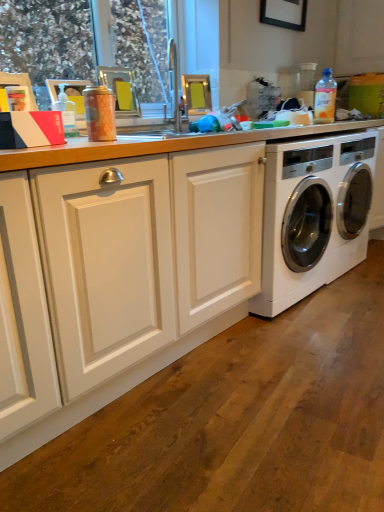
Question: Can you confirm if transparent plastic window screen at upper left is positioned to the right of transparent plastic bottle at upper left, the second bottle from the top?

Choices:
 (A) yes
 (B) no

Answer: (A)

Question: From a real-world perspective, is transparent plastic window screen at upper left located higher than transparent plastic bottle at upper left, the second bottle from the top?

Choices:
 (A) yes
 (B) no

Answer: (A)

Question: Are transparent plastic window screen at upper left and transparent plastic bottle at upper left, arranged as the first bottle when ordered from the bottom, making contact?

Choices:
 (A) yes
 (B) no

Answer: (B)

Question: Is transparent plastic window screen at upper left shorter than transparent plastic bottle at upper left, arranged as the first bottle when ordered from the bottom?

Choices:
 (A) no
 (B) yes

Answer: (A)

Question: Does transparent plastic window screen at upper left have a smaller size compared to transparent plastic bottle at upper left, arranged as the second bottle when viewed from the right?

Choices:
 (A) yes
 (B) no

Answer: (B)

Question: Considering the positions of white wood countertop at center and matte silver sink at upper center in the image, is white wood countertop at center bigger or smaller than matte silver sink at upper center?

Choices:
 (A) big
 (B) small

Answer: (A)

Question: In terms of height, does white wood countertop at center look taller or shorter compared to matte silver sink at upper center?

Choices:
 (A) short
 (B) tall

Answer: (A)

Question: Which is correct: white wood countertop at center is inside matte silver sink at upper center, or outside of it?

Choices:
 (A) inside
 (B) outside

Answer: (B)

Question: Considering the positions of white wood countertop at center and matte silver sink at upper center in the image, is white wood countertop at center wider or thinner than matte silver sink at upper center?

Choices:
 (A) thin
 (B) wide

Answer: (B)

Question: In terms of size, does white glossy washing machine at right appear bigger or smaller than transparent plastic window screen at upper left?

Choices:
 (A) big
 (B) small

Answer: (A)

Question: In the image, is white glossy washing machine at right on the left side or the right side of transparent plastic window screen at upper left?

Choices:
 (A) right
 (B) left

Answer: (A)

Question: Considering their positions, is white glossy washing machine at right located in front of or behind transparent plastic window screen at upper left?

Choices:
 (A) front
 (B) behind

Answer: (B)

Question: From a real-world perspective, is white glossy washing machine at right above or below transparent plastic window screen at upper left?

Choices:
 (A) below
 (B) above

Answer: (A)

Question: From a real-world perspective, relative to matte silver sink at upper center, is transparent plastic bottle at upper left, the first bottle from the left, vertically above or below?

Choices:
 (A) above
 (B) below

Answer: (B)

Question: From the image's perspective, relative to matte silver sink at upper center, is transparent plastic bottle at upper left, the second bottle from the top, above or below?

Choices:
 (A) above
 (B) below

Answer: (B)